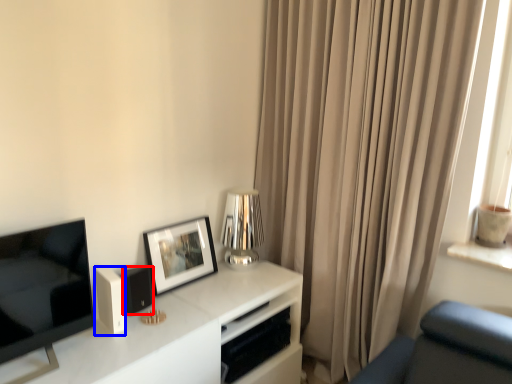
Question: Which of the following is the closest to the observer, speaker (highlighted by a red box) or appliance (highlighted by a blue box)?

Choices:
 (A) speaker
 (B) appliance

Answer: (B)